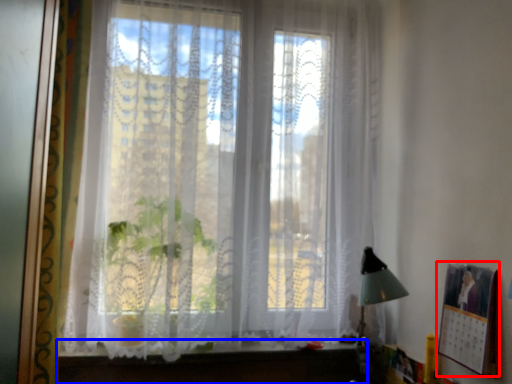
Question: Among these objects, which one is farthest to the camera, picture frame (highlighted by a red box) or vanity (highlighted by a blue box)?

Choices:
 (A) picture frame
 (B) vanity

Answer: (B)